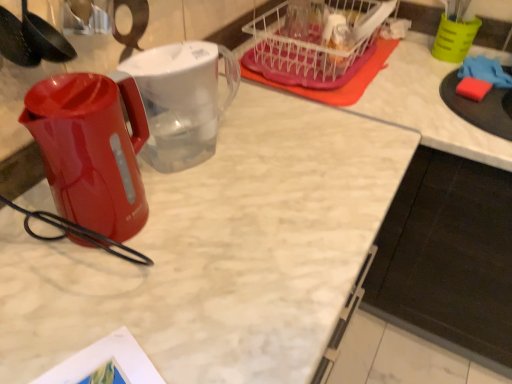
The image size is (512, 384). Find the location of `vacant space in transparent plastic pitcher at center (from a real-world perspective)`. vacant space in transparent plastic pitcher at center (from a real-world perspective) is located at coordinates (195, 160).